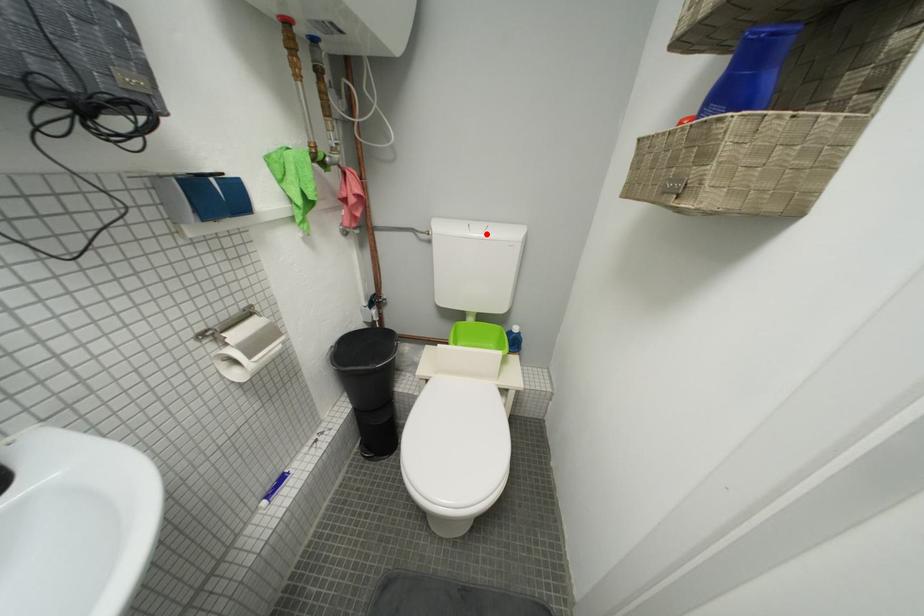
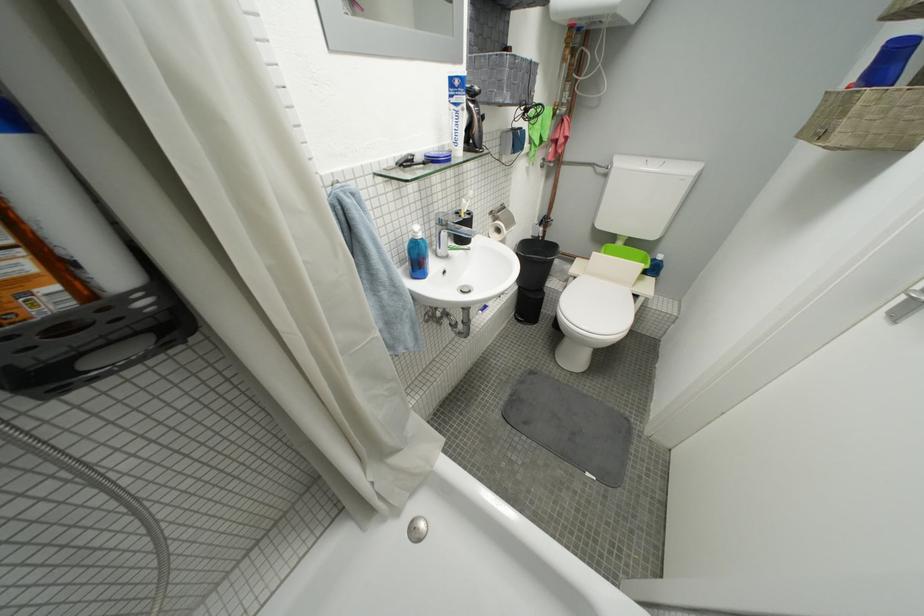
Where in the second image is the point corresponding to the highlighted location from the first image?

(662, 169)